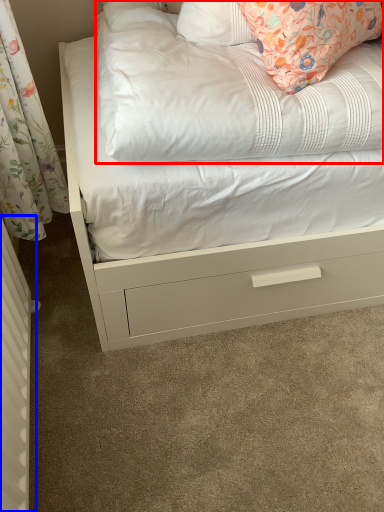
Question: Which object appears closest to the camera in this image, mattress (highlighted by a red box) or radiator (highlighted by a blue box)?

Choices:
 (A) mattress
 (B) radiator

Answer: (B)